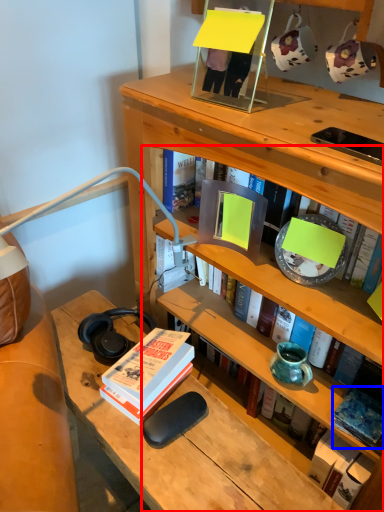
Question: Which of the following is the farthest to the observer, book (highlighted by a red box) or book (highlighted by a blue box)?

Choices:
 (A) book
 (B) book

Answer: (B)